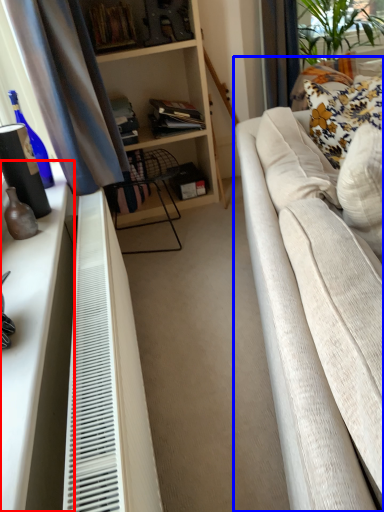
Question: Among these objects, which one is nearest to the camera, dresser (highlighted by a red box) or studio couch (highlighted by a blue box)?

Choices:
 (A) dresser
 (B) studio couch

Answer: (B)